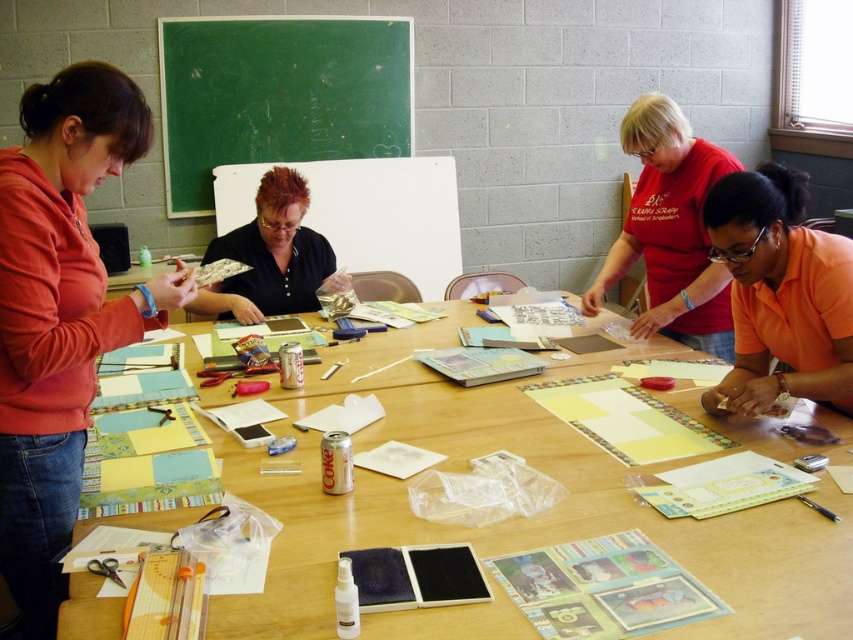
Question: Which of the following is the farthest from the observer?

Choices:
 (A) wooden table at center
 (B) matte red shirt at center
 (C) shiny black shirt at center

Answer: (C)

Question: Considering the relative positions of green chalkboard at upper center and shiny black shirt at center in the image provided, where is green chalkboard at upper center located with respect to shiny black shirt at center?

Choices:
 (A) above
 (B) below

Answer: (A)

Question: Does orange matte shirt at lower right appear over shiny black shirt at center?

Choices:
 (A) yes
 (B) no

Answer: (B)

Question: Is orange matte shirt at lower right above matte red shirt at center?

Choices:
 (A) yes
 (B) no

Answer: (B)

Question: Which point is closer to the camera taking this photo?

Choices:
 (A) (326, 51)
 (B) (648, 467)
 (C) (780, 372)

Answer: (B)

Question: Which point is closer to the camera taking this photo?

Choices:
 (A) (173, 44)
 (B) (53, 440)
 (C) (618, 244)
 (D) (747, 179)

Answer: (B)